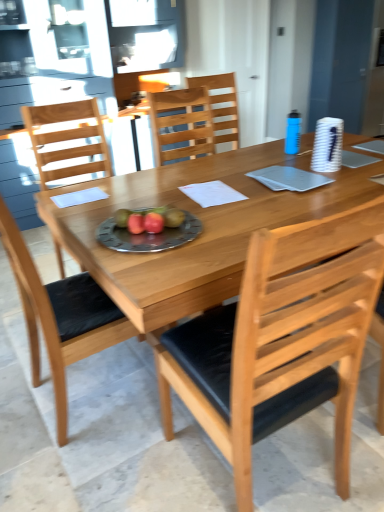
Identify the location of vacant area that lies to the right of red matte apple at center, placed as the 1th fruit when sorted from right to left. This screenshot has height=512, width=384. tap(198, 227).